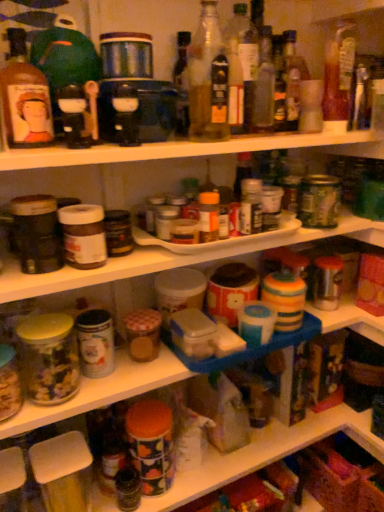
Question: Considering the relative positions of translucent glass bottle at center, which is the fourth bottle from left to right, and matte glass bottle at upper left, placed as the first bottle when sorted from left to right, in the image provided, is translucent glass bottle at center, which is the fourth bottle from left to right, to the right of matte glass bottle at upper left, placed as the first bottle when sorted from left to right, from the viewer's perspective?

Choices:
 (A) yes
 (B) no

Answer: (A)

Question: Is translucent glass bottle at center, placed as the third bottle when sorted from right to left, to the left of matte glass bottle at upper left, the 6th bottle in the right-to-left sequence, from the viewer's perspective?

Choices:
 (A) yes
 (B) no

Answer: (B)

Question: Is translucent glass bottle at center, placed as the third bottle when sorted from right to left, positioned in front of matte glass bottle at upper left, the 6th bottle in the right-to-left sequence?

Choices:
 (A) yes
 (B) no

Answer: (B)

Question: Can you confirm if translucent glass bottle at center, which is the fourth bottle from left to right, is shorter than matte glass bottle at upper left, placed as the first bottle when sorted from left to right?

Choices:
 (A) yes
 (B) no

Answer: (B)

Question: Considering the relative sizes of translucent glass bottle at center, which is the fourth bottle from left to right, and matte glass bottle at upper left, placed as the first bottle when sorted from left to right, in the image provided, is translucent glass bottle at center, which is the fourth bottle from left to right, bigger than matte glass bottle at upper left, placed as the first bottle when sorted from left to right,?

Choices:
 (A) no
 (B) yes

Answer: (A)

Question: From the image's perspective, is translucent glass bottle at center, placed as the third bottle when sorted from right to left, below matte glass bottle at upper left, the 6th bottle in the right-to-left sequence?

Choices:
 (A) no
 (B) yes

Answer: (A)

Question: Are translucent glass bottle at upper center, the third bottle in the left-to-right sequence, and translucent glass bottle at center, which is the fourth bottle from left to right, located far from each other?

Choices:
 (A) no
 (B) yes

Answer: (A)

Question: From the image's perspective, is translucent glass bottle at upper center, positioned as the fourth bottle in right-to-left order, over translucent glass bottle at center, placed as the third bottle when sorted from right to left?

Choices:
 (A) no
 (B) yes

Answer: (A)

Question: Considering the relative sizes of translucent glass bottle at upper center, the third bottle in the left-to-right sequence, and translucent glass bottle at center, placed as the third bottle when sorted from right to left, in the image provided, is translucent glass bottle at upper center, the third bottle in the left-to-right sequence, thinner than translucent glass bottle at center, placed as the third bottle when sorted from right to left,?

Choices:
 (A) no
 (B) yes

Answer: (A)

Question: Is translucent glass bottle at upper center, positioned as the fourth bottle in right-to-left order, looking in the opposite direction of translucent glass bottle at center, which is the fourth bottle from left to right?

Choices:
 (A) no
 (B) yes

Answer: (B)

Question: Considering the relative sizes of translucent glass bottle at upper center, the third bottle in the left-to-right sequence, and translucent glass bottle at center, which is the fourth bottle from left to right, in the image provided, is translucent glass bottle at upper center, the third bottle in the left-to-right sequence, taller than translucent glass bottle at center, which is the fourth bottle from left to right,?

Choices:
 (A) no
 (B) yes

Answer: (A)

Question: Considering the relative sizes of translucent glass bottle at upper center, positioned as the fourth bottle in right-to-left order, and translucent glass bottle at center, placed as the third bottle when sorted from right to left, in the image provided, is translucent glass bottle at upper center, positioned as the fourth bottle in right-to-left order, wider than translucent glass bottle at center, placed as the third bottle when sorted from right to left,?

Choices:
 (A) yes
 (B) no

Answer: (A)

Question: Considering the relative sizes of translucent glass jar at left and matte glass bottle at upper left, the 6th bottle in the right-to-left sequence, in the image provided, is translucent glass jar at left taller than matte glass bottle at upper left, the 6th bottle in the right-to-left sequence,?

Choices:
 (A) no
 (B) yes

Answer: (A)